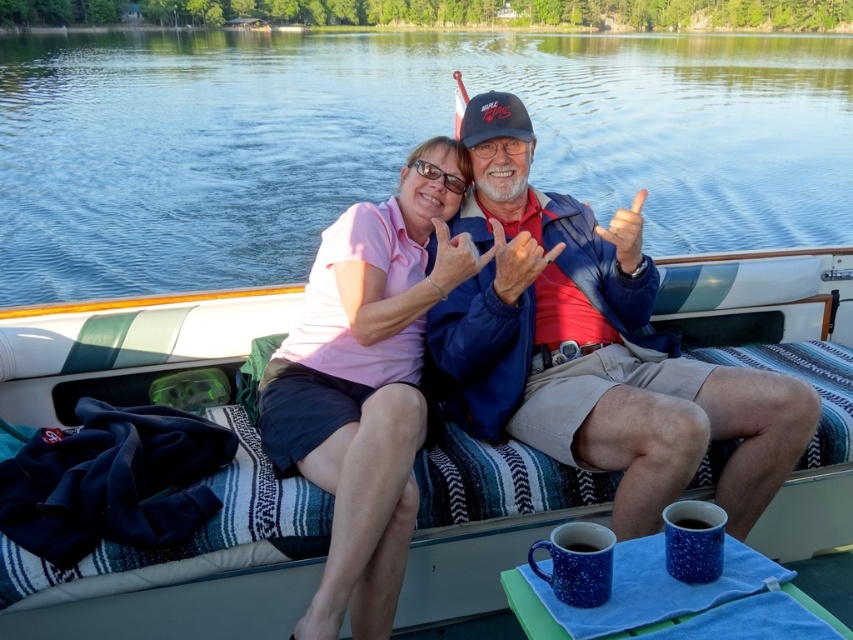
You are planning to place a small cooler on the boat. The cooler is 2 feet wide. The boat is 3.39 feet away from your current position. Can the cooler fit between the white striped fabric boat at center and the matte red hand at center?

The distance between the white striped fabric boat at center and the matte red hand at center is 3.39 feet. Since the cooler is 2 feet wide, it can fit in the space between them.

You are navigating a small drone over the boat in the image. You need to fly from point A to point B. If point A is at point (265, 122) and point B is at point (439, 225), will you fly forward or backward to reach point B?

Since point (265, 122) is behind point (439, 225), to fly from point A to point B, you would need to fly forward towards point B.

You are a photographer planning to take a photo of the blue water at center and the matte pink shirt at upper center. Which object should you focus on first if you want to ensure both are in focus?

The blue water at center is positioned over the matte pink shirt at upper center, so focusing on the matte pink shirt at upper center first would ensure both are in focus since it is closer to the camera.